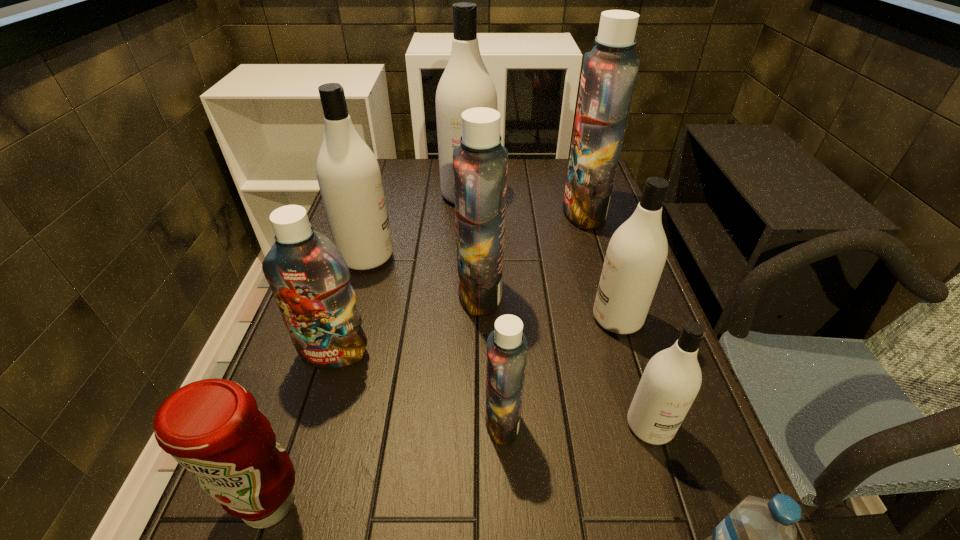
Locate an element on the screen. free space that satisfies the following two spatial constraints: 1. on the front label of the second biggest blue shampoo; 2. on the front side of the ninth farthest object is located at coordinates (480, 503).